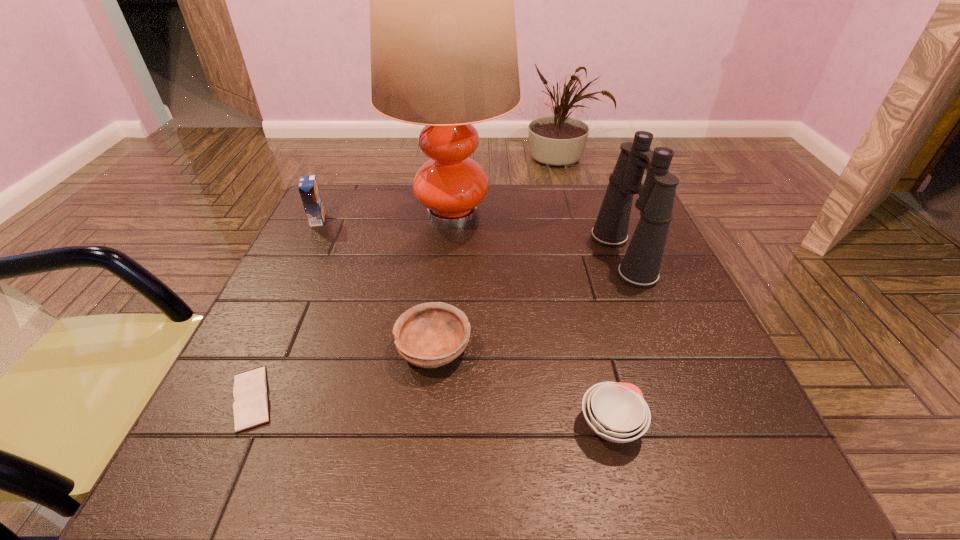
Locate an element on the screen. This screenshot has width=960, height=540. free spot between the diary and the third tallest object is located at coordinates (285, 309).

Where is `free space between the tallest object and the binoculars`? This screenshot has width=960, height=540. free space between the tallest object and the binoculars is located at coordinates (538, 235).

I want to click on free point between the orange_juice and the diary, so click(x=285, y=309).

Image resolution: width=960 pixels, height=540 pixels. What are the coordinates of `vacant area that lies between the bowl and the rightmost object` in the screenshot? It's located at (528, 302).

Identify the location of free space between the second object from right to left and the bowl. Image resolution: width=960 pixels, height=540 pixels. (522, 387).

Find the location of a particular element. This screenshot has height=540, width=960. free space that is in between the bowl and the tallest object is located at coordinates (443, 282).

Identify the location of unoccupied position between the bowl and the tallest object. (443, 282).

Find the location of a particular element. The image size is (960, 540). free space between the orange_juice and the binoculars is located at coordinates [470, 238].

Where is `the second closest object to the fourth shortest object`? The width and height of the screenshot is (960, 540). the second closest object to the fourth shortest object is located at coordinates (429, 335).

Select which object is the fourth closest to the fourth shortest object. Please provide its 2D coordinates. Your answer should be formatted as a tuple, i.e. [(x, y)], where the tuple contains the x and y coordinates of a point satisfying the conditions above.

[(640, 266)]